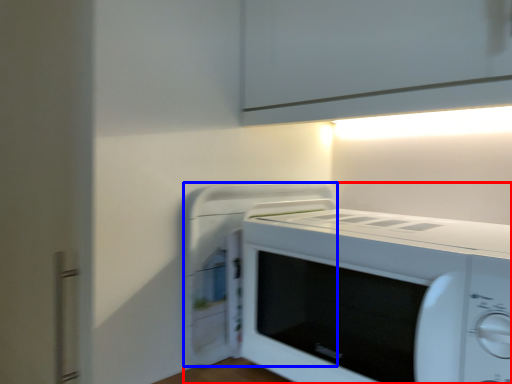
Question: Which of the following is the farthest to the observer, home appliance (highlighted by a red box) or appliance (highlighted by a blue box)?

Choices:
 (A) home appliance
 (B) appliance

Answer: (B)